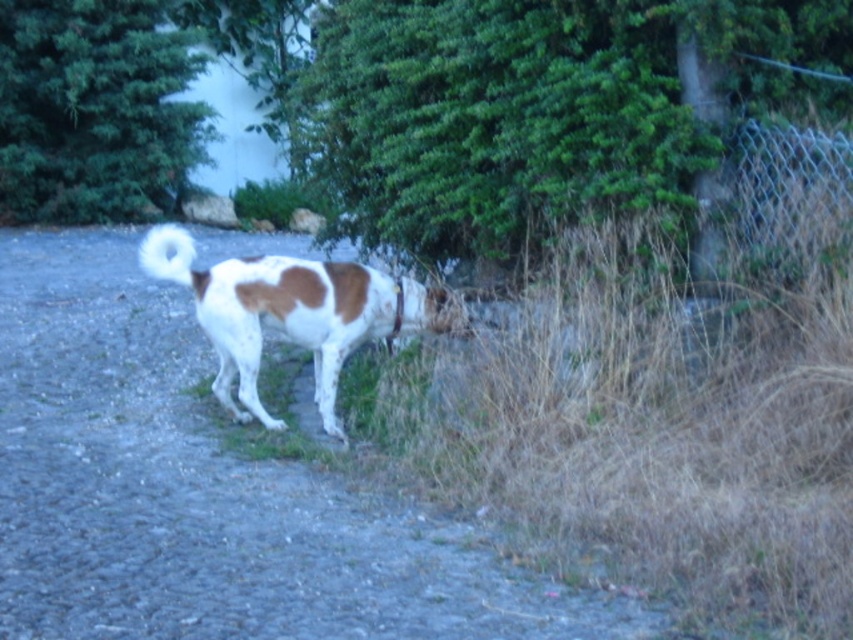
The image size is (853, 640). Describe the element at coordinates (207, 492) in the screenshot. I see `dirt track at center` at that location.

Who is positioned more to the right, dirt track at center or wire mesh fence at right?

Positioned to the right is wire mesh fence at right.

Who is more forward, (19, 378) or (785, 150)?

Point (785, 150) is more forward.

Where is `dirt track at center`? The image size is (853, 640). dirt track at center is located at coordinates (207, 492).

Which is more to the left, dirt track at center or brown and white fur at center?

From the viewer's perspective, dirt track at center appears more on the left side.

Is point (224, 257) closer to camera compared to point (236, 420)?

That is False.

Image resolution: width=853 pixels, height=640 pixels. Identify the location of dirt track at center. (207, 492).

Between point (351, 273) and point (163, 230), which one is positioned behind?

The point (163, 230) is behind.

Locate an element on the screen. The width and height of the screenshot is (853, 640). brown and white fur at center is located at coordinates (293, 314).

Does point (389, 316) come closer to viewer compared to point (178, 228)?

Yes, point (389, 316) is in front of point (178, 228).

Locate an element on the screen. The height and width of the screenshot is (640, 853). brown and white fur at center is located at coordinates (x=293, y=314).